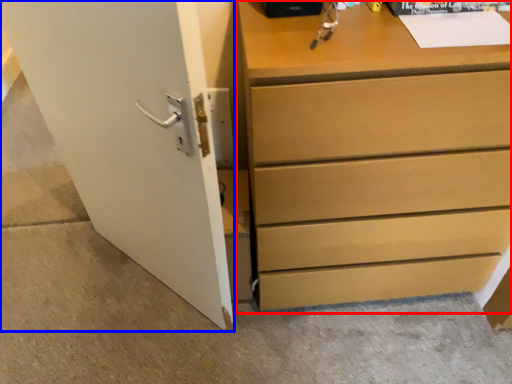
Question: Which of the following is the closest to the observer, chest of drawers (highlighted by a red box) or door (highlighted by a blue box)?

Choices:
 (A) chest of drawers
 (B) door

Answer: (B)